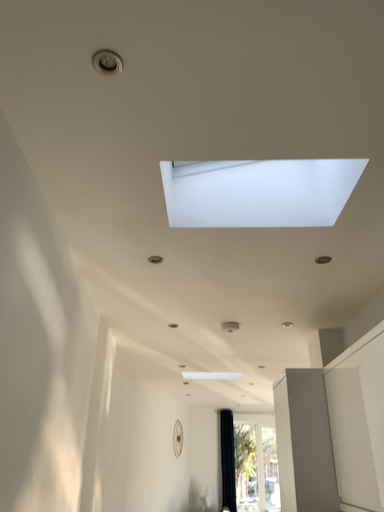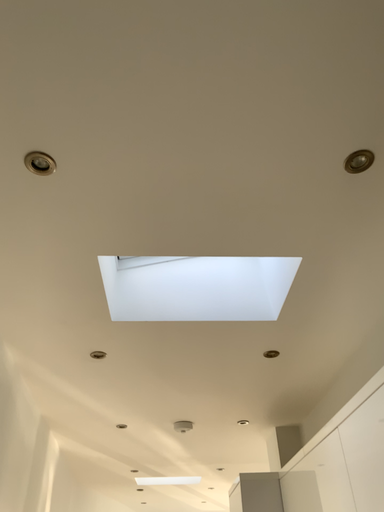
Question: How did the camera likely rotate when shooting the video?

Choices:
 (A) rotated upward
 (B) rotated downward

Answer: (A)